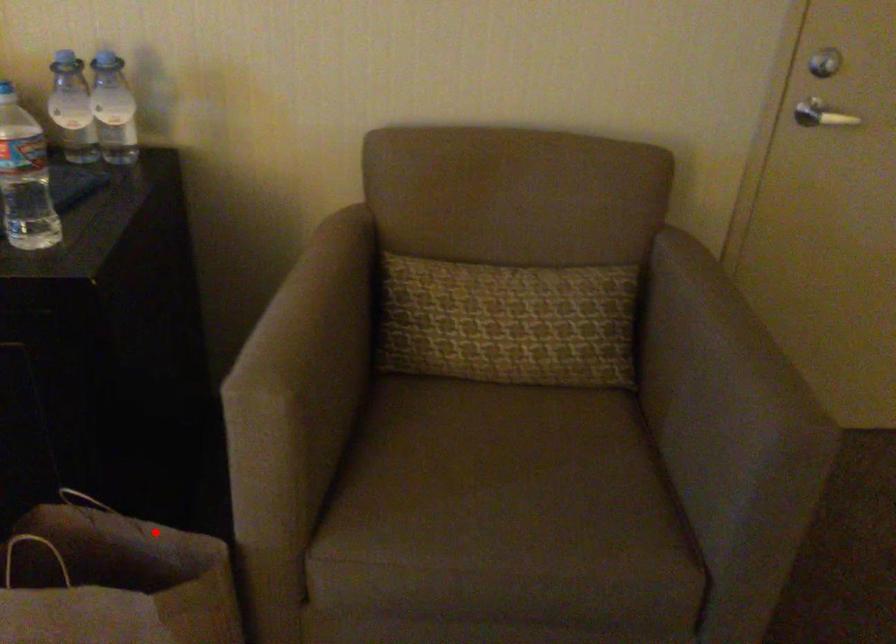
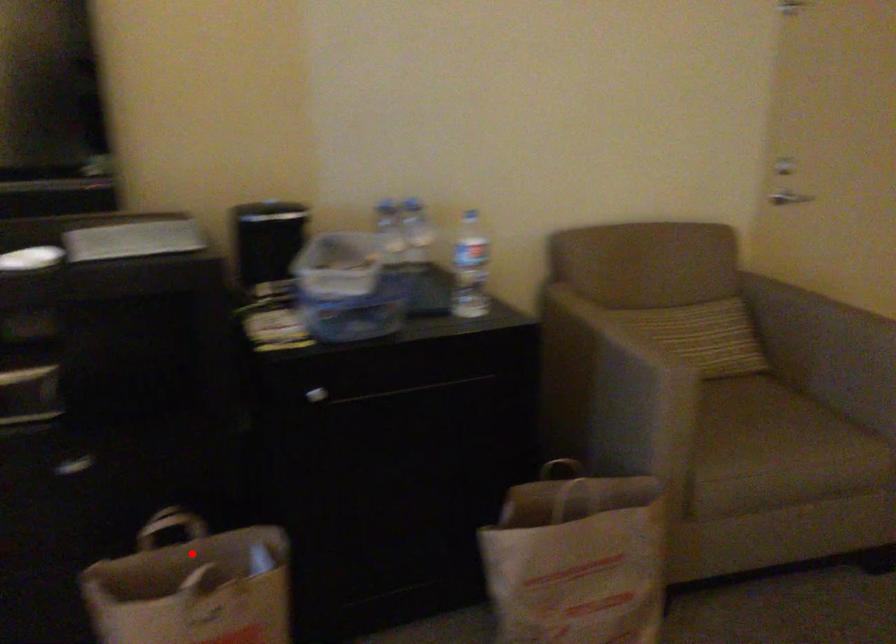
I am providing you with two images of the same scene from different viewpoints. A red point is marked on the first image and another point is marked on the second image. Is the marked point in image1 the same physical position as the marked point in image2?

No